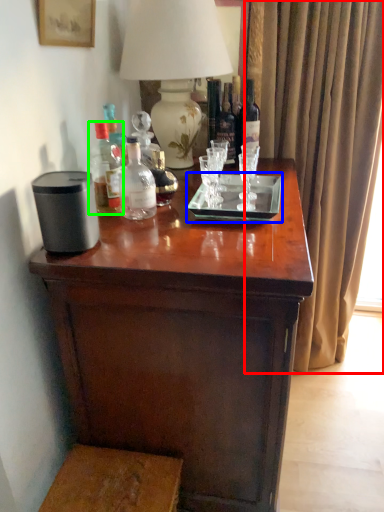
Question: Based on their relative distances, which object is farther from curtain (highlighted by a red box)? Choose from glass plate (highlighted by a blue box) and bottle (highlighted by a green box).

Choices:
 (A) glass plate
 (B) bottle

Answer: (B)